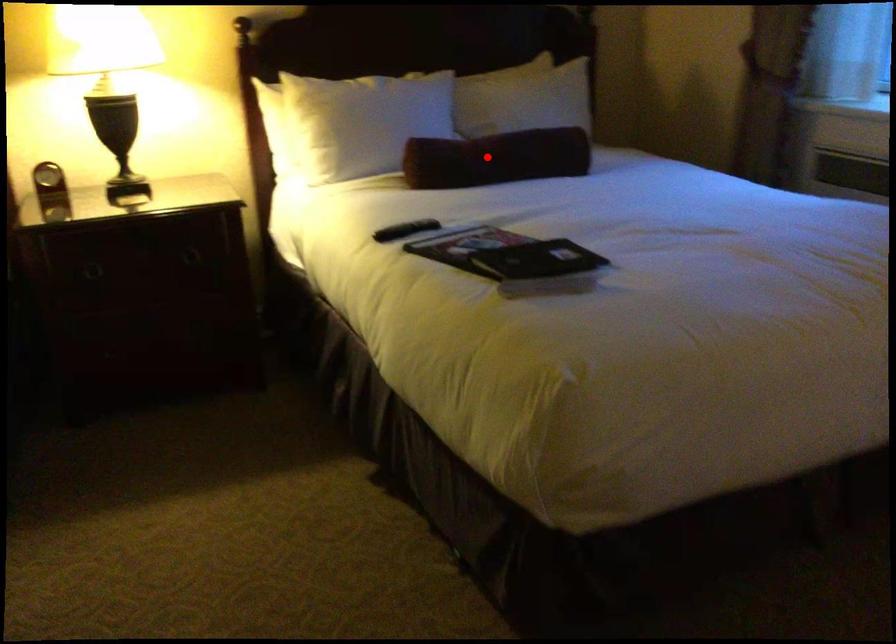
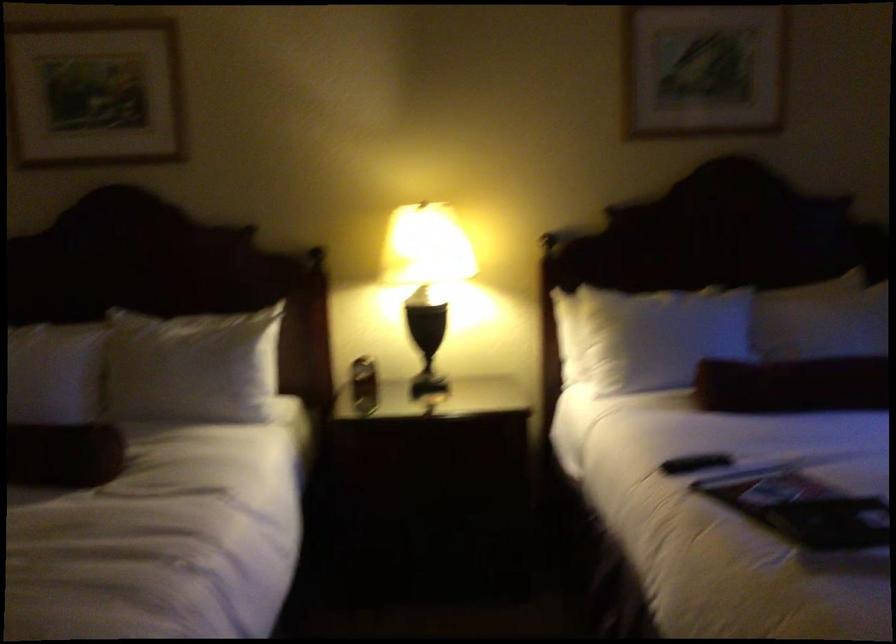
Locate, in the second image, the point that corresponds to the highlighted location in the first image.

(793, 384)